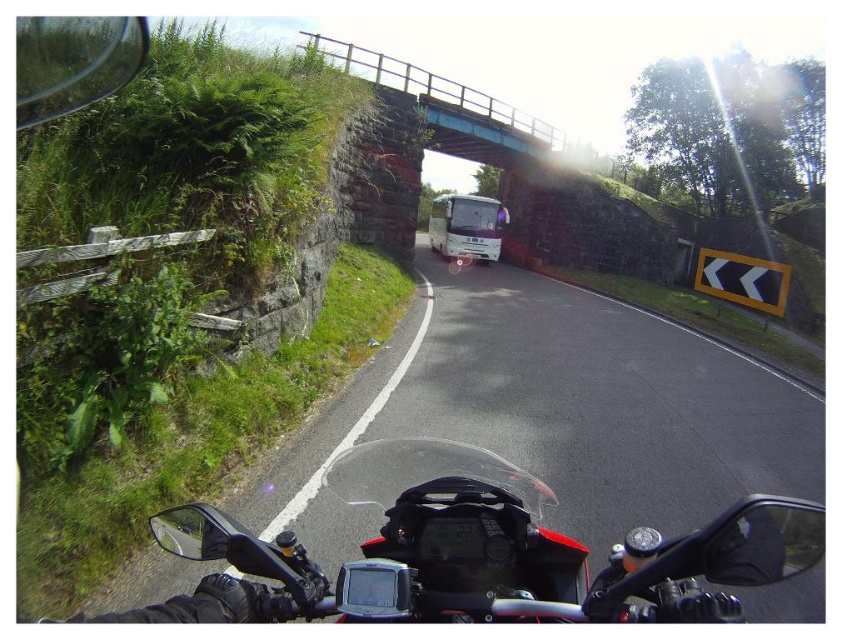
Looking at this image, is blue painted concrete bridge at upper center positioned behind white glossy bus at center?

No, blue painted concrete bridge at upper center is closer to the viewer.

Can you confirm if blue painted concrete bridge at upper center is taller than white glossy bus at center?

Indeed, blue painted concrete bridge at upper center has a greater height compared to white glossy bus at center.

The height and width of the screenshot is (640, 842). What do you see at coordinates (451, 108) in the screenshot? I see `blue painted concrete bridge at upper center` at bounding box center [451, 108].

Identify the location of blue painted concrete bridge at upper center. (451, 108).